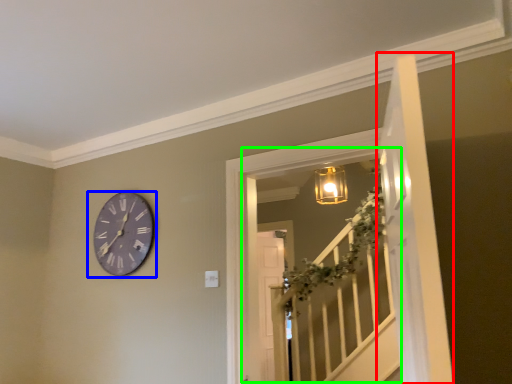
Question: Which object is positioned farthest from door (highlighted by a red box)? Select from wall clock (highlighted by a blue box) and window (highlighted by a green box).

Choices:
 (A) wall clock
 (B) window

Answer: (B)